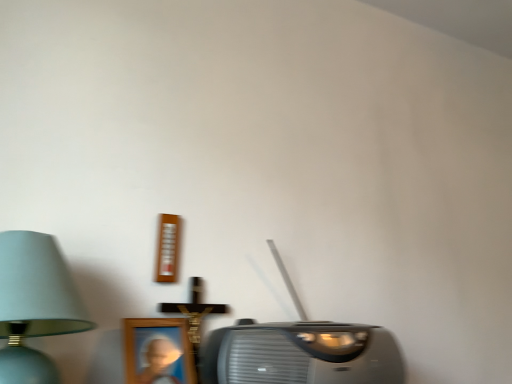
Question: Is metallic gray stereo at center wider or thinner than light blue fabric lampshade at left?

Choices:
 (A) thin
 (B) wide

Answer: (A)

Question: Based on their sizes in the image, would you say metallic gray stereo at center is bigger or smaller than light blue fabric lampshade at left?

Choices:
 (A) big
 (B) small

Answer: (A)

Question: Considering the positions of metallic gray stereo at center and light blue fabric lampshade at left in the image, is metallic gray stereo at center taller or shorter than light blue fabric lampshade at left?

Choices:
 (A) short
 (B) tall

Answer: (A)

Question: From the image's perspective, is light blue fabric lampshade at left above or below metallic gray stereo at center?

Choices:
 (A) below
 (B) above

Answer: (B)

Question: Is light blue fabric lampshade at left in front of or behind metallic gray stereo at center in the image?

Choices:
 (A) front
 (B) behind

Answer: (A)

Question: In terms of height, does light blue fabric lampshade at left look taller or shorter compared to metallic gray stereo at center?

Choices:
 (A) tall
 (B) short

Answer: (A)

Question: Is light blue fabric lampshade at left situated inside metallic gray stereo at center or outside?

Choices:
 (A) outside
 (B) inside

Answer: (A)